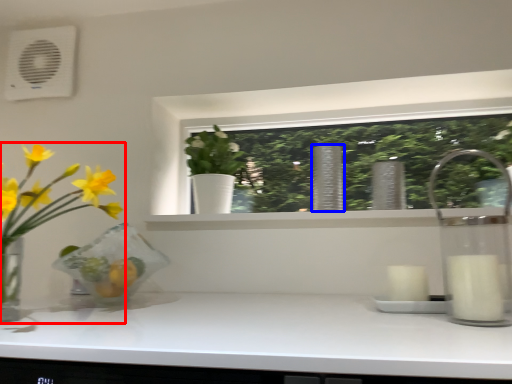
Question: Among these objects, which one is farthest to the camera, houseplant (highlighted by a red box) or vase (highlighted by a blue box)?

Choices:
 (A) houseplant
 (B) vase

Answer: (B)